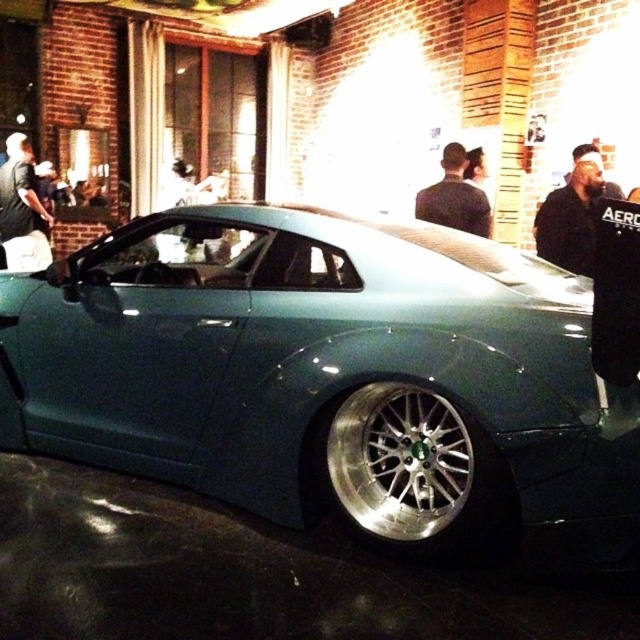
Question: Among these points, which one is farthest from the camera?

Choices:
 (A) (330, 458)
 (B) (492, 458)
 (C) (540, 244)
 (D) (449, 198)

Answer: (D)

Question: Which object is the closest to the dark gray fabric jacket at upper center?

Choices:
 (A) teal metallic car at center
 (B) silver polished rim at lower center

Answer: (A)

Question: Does black leather jacket at upper right have a lesser width compared to black leather jacket at upper left?

Choices:
 (A) no
 (B) yes

Answer: (B)

Question: Which point is closer to the camera?

Choices:
 (A) (433, 493)
 (B) (570, 232)
 (C) (480, 225)
 (D) (397, 385)

Answer: (D)

Question: Can you confirm if silver polished rim at lower center is positioned to the right of black leather jacket at upper left?

Choices:
 (A) yes
 (B) no

Answer: (A)

Question: Can you confirm if teal metallic car at center is thinner than black leather jacket at upper left?

Choices:
 (A) no
 (B) yes

Answer: (A)